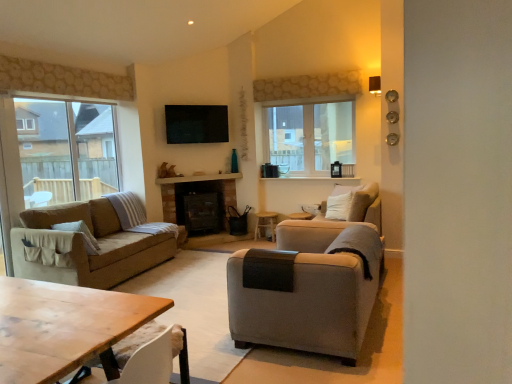
Locate an element on the screen. clear glass window at center, acting as the 1th window starting from the right is located at coordinates (310, 135).

This screenshot has width=512, height=384. Identify the location of clear glass window at left, positioned as the first window in left-to-right order. (65, 150).

Find the location of a particular element. The height and width of the screenshot is (384, 512). transparent glass screen door at left is located at coordinates (9, 177).

The image size is (512, 384). Describe the element at coordinates (266, 224) in the screenshot. I see `wooden side table at center` at that location.

Describe the element at coordinates (329, 224) in the screenshot. This screenshot has width=512, height=384. I see `light gray fabric armchair at right` at that location.

At what (x,y) coordinates should I click in order to perform the action: click on wooden table at lower left. Please return your answer as a coordinate pair (x, y). Looking at the image, I should click on (64, 327).

In terms of size, does light gray fabric armchair at center appear bigger or smaller than wooden side table at center?

Considering their sizes, light gray fabric armchair at center takes up more space than wooden side table at center.

Between point (331, 248) and point (275, 218), which one is positioned behind?

The point (275, 218) is farther.

In the scene shown: Do you think light gray fabric armchair at center is within wooden side table at center, or outside of it?

light gray fabric armchair at center lies outside wooden side table at center.

Is transparent glass screen door at left facing towards light gray fabric armchair at center?

No.

Considering the sizes of transparent glass screen door at left and light gray fabric armchair at center in the image, is transparent glass screen door at left taller or shorter than light gray fabric armchair at center?

transparent glass screen door at left is taller than light gray fabric armchair at center.

From a real-world perspective, is transparent glass screen door at left physically above light gray fabric armchair at center?

Correct, in the physical world, transparent glass screen door at left is higher than light gray fabric armchair at center.

Does point (11, 180) appear closer or farther from the camera than point (355, 340)?

Point (11, 180) is positioned farther from the camera compared to point (355, 340).

Where is `screen door in front of the wooden side table at center`? This screenshot has width=512, height=384. screen door in front of the wooden side table at center is located at coordinates (9, 177).

Considering the relative sizes of wooden side table at center and transparent glass screen door at left in the image provided, is wooden side table at center smaller than transparent glass screen door at left?

Yes, wooden side table at center is smaller than transparent glass screen door at left.

Is wooden side table at center turned away from transparent glass screen door at left?

That's not correct — wooden side table at center is not looking away from transparent glass screen door at left.

Based on the photo, considering the relative sizes of wooden side table at center and wooden table at lower left in the image provided, is wooden side table at center bigger than wooden table at lower left?

No, wooden side table at center is not bigger than wooden table at lower left.

Based on the photo, from the image's perspective, is wooden side table at center on top of wooden table at lower left?

Correct, wooden side table at center appears higher than wooden table at lower left in the image.

Locate an element on the screen. Image resolution: width=512 pixels, height=384 pixels. side table on the right side of wooden table at lower left is located at coordinates (266, 224).

In the scene shown: Relative to clear glass window at center, which is the first window from back to front, is transparent glass screen door at left in front or behind?

In the image, transparent glass screen door at left appears in front of clear glass window at center, which is the first window from back to front.

Would you say transparent glass screen door at left is to the left or to the right of clear glass window at center, acting as the 1th window starting from the right, in the picture?

In the image, transparent glass screen door at left appears on the left side of clear glass window at center, acting as the 1th window starting from the right.

How distant is transparent glass screen door at left from clear glass window at center, the 2th window positioned from the left?

They are 12.17 feet apart.

In terms of width, does transparent glass screen door at left look wider or thinner when compared to clear glass window at center, which appears as the 2th window when viewed from the front?

transparent glass screen door at left is thinner than clear glass window at center, which appears as the 2th window when viewed from the front.

Is light gray fabric armchair at center to the right of transparent glass screen door at left from the viewer's perspective?

Yes, light gray fabric armchair at center is to the right of transparent glass screen door at left.

Does light gray fabric armchair at center have a greater height compared to transparent glass screen door at left?

In fact, light gray fabric armchair at center may be shorter than transparent glass screen door at left.

Where is `chair that appears below the transparent glass screen door at left (from a real-world perspective)`? The height and width of the screenshot is (384, 512). chair that appears below the transparent glass screen door at left (from a real-world perspective) is located at coordinates (307, 291).

Do you think light gray fabric armchair at right is within light gray fabric armchair at center, or outside of it?

light gray fabric armchair at right cannot be found inside light gray fabric armchair at center.

Considering the positions of objects light gray fabric armchair at right and light gray fabric armchair at center in the image provided, who is more to the left, light gray fabric armchair at right or light gray fabric armchair at center?

light gray fabric armchair at center is more to the left.

Which point is more distant from viewer, (375, 201) or (266, 258)?

Positioned behind is point (375, 201).

Is light gray fabric armchair at right turned away from light gray fabric armchair at center?

No, light gray fabric armchair at right's orientation is not away from light gray fabric armchair at center.

The height and width of the screenshot is (384, 512). Find the location of `side table lying above the light gray fabric armchair at center (from the image's perspective)`. side table lying above the light gray fabric armchair at center (from the image's perspective) is located at coordinates (266, 224).

Locate an element on the screen. chair that appears below the transparent glass screen door at left (from the image's perspective) is located at coordinates (307, 291).

Which object lies nearer to the anchor point clear glass window at center, acting as the 1th window starting from the right, light gray fabric armchair at right or transparent glass screen door at left?

light gray fabric armchair at right is closer to clear glass window at center, acting as the 1th window starting from the right.

Based on their spatial positions, is transparent glass screen door at left or light gray fabric armchair at right further from light gray fabric armchair at center?

Based on the image, transparent glass screen door at left appears to be further to light gray fabric armchair at center.

Looking at the image, which one is located closer to transparent glass screen door at left, light gray fabric armchair at right or clear glass window at center, which is the first window from back to front?

light gray fabric armchair at right is closer to transparent glass screen door at left.

From the image, which object appears to be farther from transparent glass screen door at left, light gray fabric armchair at right or clear glass window at left, positioned as the first window in left-to-right order?

Based on the image, light gray fabric armchair at right appears to be further to transparent glass screen door at left.

Estimate the real-world distances between objects in this image. Which object is further from clear glass window at center, which is the first window from back to front, clear glass window at left, positioned as the first window in left-to-right order, or transparent glass screen door at left?

transparent glass screen door at left.

From the image, which object appears to be nearer to light gray fabric armchair at center, transparent glass screen door at left or clear glass window at center, which appears as the 2th window when viewed from the front?

clear glass window at center, which appears as the 2th window when viewed from the front.

From the picture: Based on their spatial positions, is clear glass window at center, acting as the 1th window starting from the right, or transparent glass screen door at left further from wooden table at lower left?

clear glass window at center, acting as the 1th window starting from the right, is further to wooden table at lower left.

Looking at the image, which one is located further to light gray fabric armchair at center, transparent glass screen door at left or wooden table at lower left?

transparent glass screen door at left is further to light gray fabric armchair at center.

At what (x,y) coordinates should I click in order to perform the action: click on window between transparent glass screen door at left and clear glass window at center, the 2th window positioned from the left. Please return your answer as a coordinate pair (x, y). The width and height of the screenshot is (512, 384). Looking at the image, I should click on (65, 150).

Locate an element on the screen. This screenshot has height=384, width=512. window between wooden table at lower left and clear glass window at center, the 2th window positioned from the left, along the z-axis is located at coordinates (65, 150).

I want to click on chair between clear glass window at left, acting as the first window starting from the front, and clear glass window at center, the 2th window positioned from the left, in the horizontal direction, so click(x=307, y=291).

The image size is (512, 384). Identify the location of chair between transparent glass screen door at left and clear glass window at center, which is the first window from back to front. (307, 291).